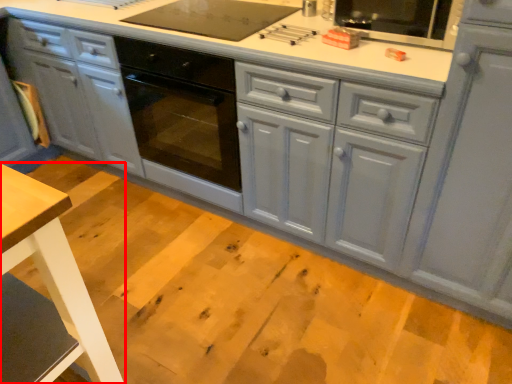
Question: Considering the relative positions of table (annotated by the red box) and cabinetry in the image provided, where is table (annotated by the red box) located with respect to the staircase?

Choices:
 (A) left
 (B) right

Answer: (A)